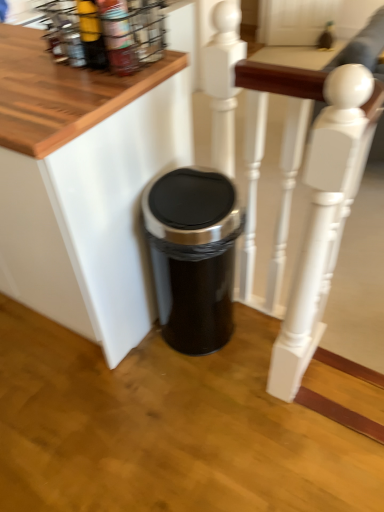
Find the location of a particular element. vacant space in front of metallic wire spice rack at upper left is located at coordinates (52, 92).